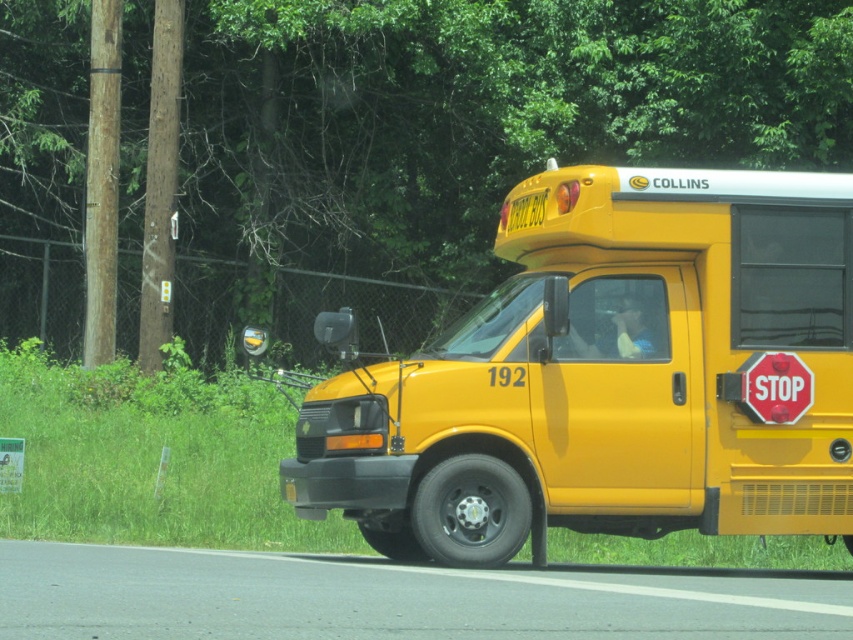
Between matte yellow school bus at center and red matte stop sign at center, which one is positioned lower?

matte yellow school bus at center

Does matte yellow school bus at center appear under red matte stop sign at center?

Yes.

Is point (540, 449) behind point (779, 376)?

That is False.

Image resolution: width=853 pixels, height=640 pixels. What are the coordinates of `matte yellow school bus at center` in the screenshot? It's located at (607, 376).

Does green leafy tree at upper center appear under matte yellow school bus at center?

No, green leafy tree at upper center is not below matte yellow school bus at center.

Based on the photo, who is positioned more to the left, green leafy tree at upper center or matte yellow school bus at center?

Positioned to the left is green leafy tree at upper center.

Which is behind, point (465, 61) or point (462, 444)?

Positioned behind is point (465, 61).

Locate an element on the screen. green leafy tree at upper center is located at coordinates (477, 115).

Can you confirm if green leafy tree at upper center is bigger than red matte stop sign at center?

Indeed, green leafy tree at upper center has a larger size compared to red matte stop sign at center.

The width and height of the screenshot is (853, 640). What do you see at coordinates (477, 115) in the screenshot? I see `green leafy tree at upper center` at bounding box center [477, 115].

I want to click on green leafy tree at upper center, so click(x=477, y=115).